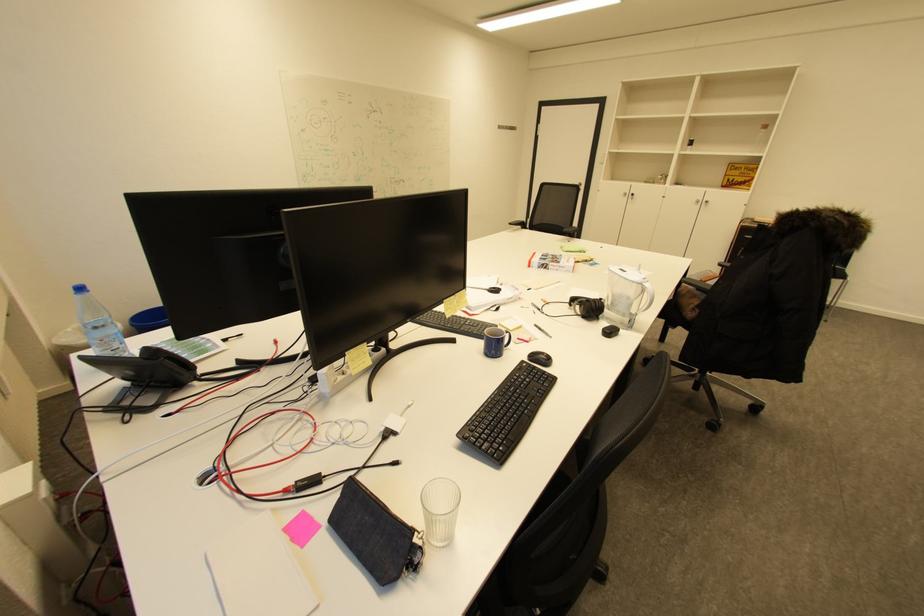
Where would you lift the water pitcher handle? Please return your answer as a coordinate pair (x, y).

(626, 296)